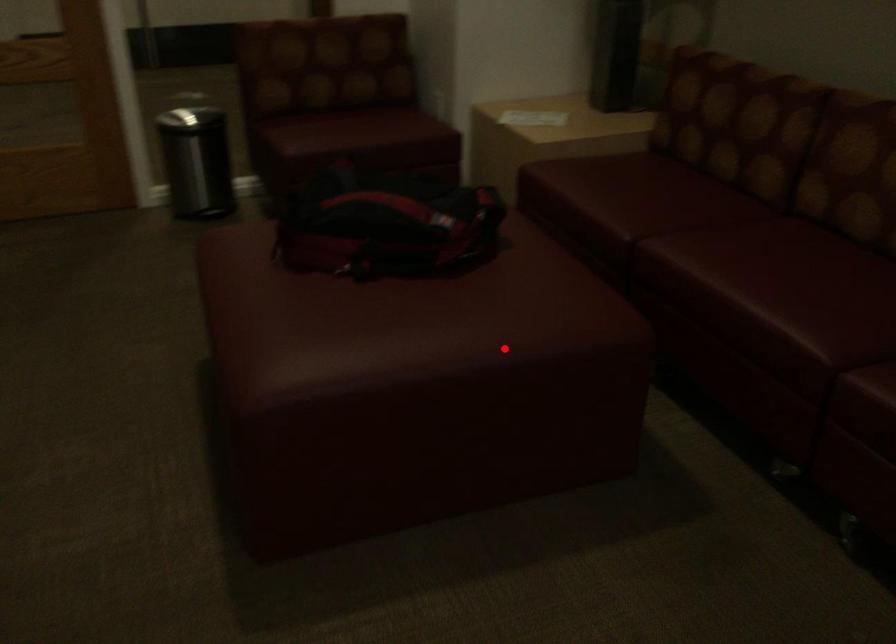
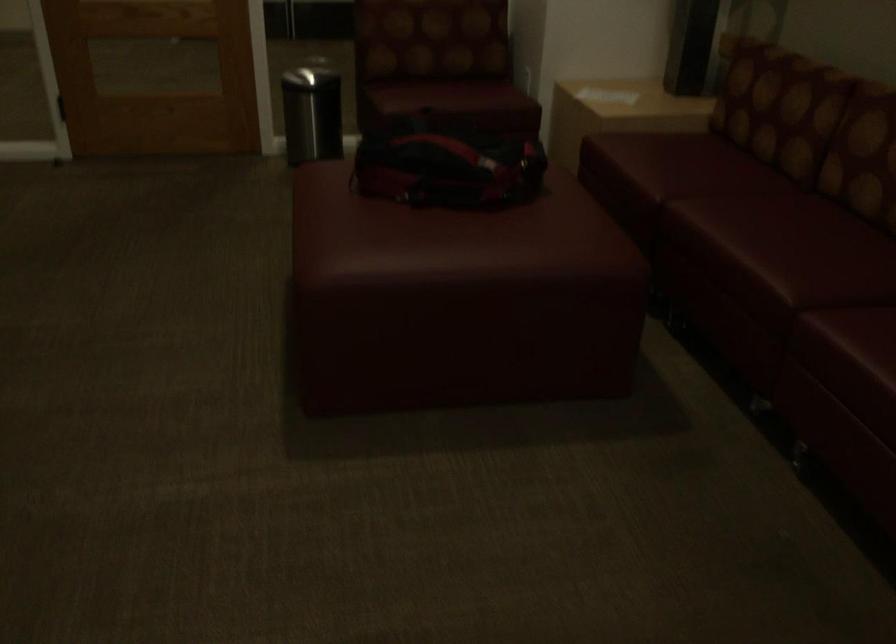
Where in the second image is the point corresponding to the highlighted location from the first image?

(517, 267)